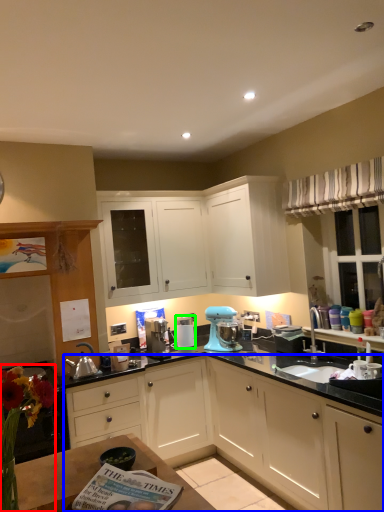
Question: Based on their relative distances, which object is nearer to floral arrangement (highlighted by a red box)? Choose from cabinetry (highlighted by a blue box) and appliance (highlighted by a green box).

Choices:
 (A) cabinetry
 (B) appliance

Answer: (A)